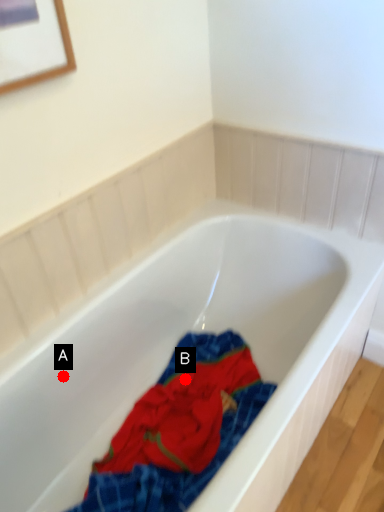
Question: Two points are circled on the image, labeled by A and B beside each circle. Which point is further to the camera?

Choices:
 (A) A is further
 (B) B is further

Answer: (B)